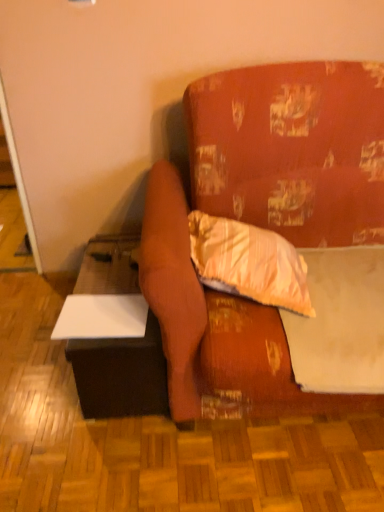
The width and height of the screenshot is (384, 512). Describe the element at coordinates (292, 150) in the screenshot. I see `textured orange couch at center` at that location.

Where is `white matte sheet at upper right`? The height and width of the screenshot is (512, 384). white matte sheet at upper right is located at coordinates (340, 322).

What do you see at coordinates (340, 322) in the screenshot?
I see `white matte sheet at upper right` at bounding box center [340, 322].

Image resolution: width=384 pixels, height=512 pixels. Find the location of `textured orange couch at center`. textured orange couch at center is located at coordinates (292, 150).

Between textured orange couch at center and striped fabric pillow at center, which one has larger size?

Bigger between the two is textured orange couch at center.

Is textured orange couch at center turned away from striped fabric pillow at center?

Yes, textured orange couch at center is positioned with its back facing striped fabric pillow at center.

Is point (248, 83) behind point (274, 283)?

Yes, point (248, 83) is behind point (274, 283).

At what (x,y) coordinates should I click in order to perform the action: click on table behind the textured orange couch at center. Please return your answer as a coordinate pair (x, y). The image size is (384, 512). Looking at the image, I should click on (113, 335).

Which is more to the right, white matte table at lower left or textured orange couch at center?

textured orange couch at center.

Is white matte table at lower left not within textured orange couch at center?

Yes.

Could you tell me if striped fabric pillow at center is facing textured orange couch at center?

Yes, striped fabric pillow at center is aimed at textured orange couch at center.

Which of these two, striped fabric pillow at center or textured orange couch at center, is wider?

textured orange couch at center is wider.

Considering the sizes of objects striped fabric pillow at center and textured orange couch at center in the image provided, who is taller, striped fabric pillow at center or textured orange couch at center?

Standing taller between the two is textured orange couch at center.

Which is in front, striped fabric pillow at center or textured orange couch at center?

textured orange couch at center is in front.

From the picture: Can we say striped fabric pillow at center lies outside white matte sheet at upper right?

That's correct, striped fabric pillow at center is outside of white matte sheet at upper right.

Which point is more forward, (304, 314) or (308, 342)?

The point (308, 342) is in front.

Relative to white matte sheet at upper right, is striped fabric pillow at center in front or behind?

In the image, striped fabric pillow at center appears behind white matte sheet at upper right.

Is striped fabric pillow at center facing away from white matte sheet at upper right?

No, striped fabric pillow at center is not facing the opposite direction of white matte sheet at upper right.

Is white matte sheet at upper right facing away from striped fabric pillow at center?

No, white matte sheet at upper right is not facing away from striped fabric pillow at center.

Considering the positions of points (359, 330) and (241, 280), is point (359, 330) closer to camera compared to point (241, 280)?

Yes, it is in front of point (241, 280).

The height and width of the screenshot is (512, 384). What are the coordinates of `pillow above the white matte sheet at upper right (from the image's perspective)` in the screenshot? It's located at (249, 262).

Can you confirm if white matte sheet at upper right is bigger than striped fabric pillow at center?

Correct, white matte sheet at upper right is larger in size than striped fabric pillow at center.

Measure the distance between textured orange couch at center and white matte sheet at upper right.

The distance of textured orange couch at center from white matte sheet at upper right is 10.73 inches.

Is textured orange couch at center spatially inside white matte sheet at upper right, or outside of it?

textured orange couch at center lies outside white matte sheet at upper right.

Which of these two, textured orange couch at center or white matte sheet at upper right, is bigger?

With larger size is textured orange couch at center.

Is textured orange couch at center touching white matte sheet at upper right?

No, textured orange couch at center is not next to white matte sheet at upper right.

From the image's perspective, which object appears higher, striped fabric pillow at center or white matte table at lower left?

striped fabric pillow at center.

Between striped fabric pillow at center and white matte table at lower left, which one has more height?

white matte table at lower left.

Between striped fabric pillow at center and white matte table at lower left, which one has larger size?

white matte table at lower left.

Is striped fabric pillow at center positioned with its back to white matte table at lower left?

No, striped fabric pillow at center's orientation is not away from white matte table at lower left.

Where is `studio couch on the right of striped fabric pillow at center`? This screenshot has width=384, height=512. studio couch on the right of striped fabric pillow at center is located at coordinates (292, 150).

Identify the location of studio couch above the white matte table at lower left (from a real-world perspective). (292, 150).

When comparing their distances from white matte table at lower left, does striped fabric pillow at center or white matte sheet at upper right seem further?

The object further to white matte table at lower left is white matte sheet at upper right.

When comparing their distances from white matte sheet at upper right, does striped fabric pillow at center or textured orange couch at center seem further?

textured orange couch at center.

Looking at this image, from the image, which object appears to be nearer to striped fabric pillow at center, white matte table at lower left or white matte sheet at upper right?

white matte sheet at upper right.

Considering their positions, is striped fabric pillow at center positioned closer to white matte sheet at upper right than white matte table at lower left?

Among the two, striped fabric pillow at center is located nearer to white matte sheet at upper right.

Based on their spatial positions, is striped fabric pillow at center or textured orange couch at center closer to white matte table at lower left?

The object closer to white matte table at lower left is striped fabric pillow at center.

When comparing their distances from textured orange couch at center, does white matte table at lower left or striped fabric pillow at center seem closer?

striped fabric pillow at center is positioned closer to the anchor textured orange couch at center.

Estimate the real-world distances between objects in this image. Which object is further from textured orange couch at center, white matte sheet at upper right or white matte table at lower left?

The object further to textured orange couch at center is white matte table at lower left.

Which object lies nearer to the anchor point striped fabric pillow at center, white matte sheet at upper right or textured orange couch at center?

The object closer to striped fabric pillow at center is white matte sheet at upper right.

This screenshot has height=512, width=384. In order to click on pillow located between white matte table at lower left and textured orange couch at center in the left-right direction in this screenshot , I will do `click(249, 262)`.

Where is `sheet positioned between textured orange couch at center and striped fabric pillow at center from near to far`? The width and height of the screenshot is (384, 512). sheet positioned between textured orange couch at center and striped fabric pillow at center from near to far is located at coordinates (x=340, y=322).

Where is `pillow located between white matte table at lower left and white matte sheet at upper right in the left-right direction`? Image resolution: width=384 pixels, height=512 pixels. pillow located between white matte table at lower left and white matte sheet at upper right in the left-right direction is located at coordinates (249, 262).

Identify the location of studio couch between white matte table at lower left and white matte sheet at upper right. The width and height of the screenshot is (384, 512). click(292, 150).